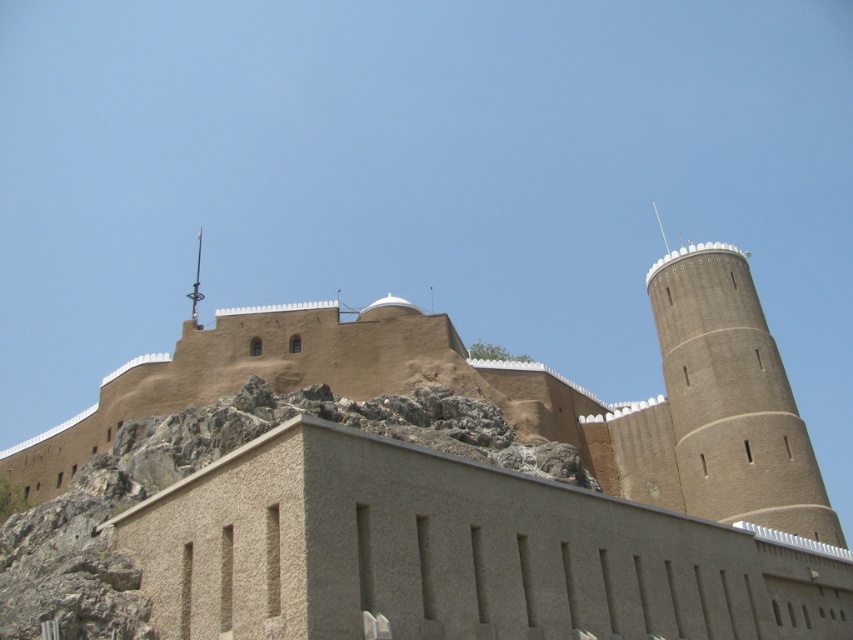
From the picture: Who is higher up, brown textured castle at center or brown textured tower at right?

brown textured tower at right is higher up.

Who is lower down, brown textured castle at center or brown textured tower at right?

Positioned lower is brown textured castle at center.

Image resolution: width=853 pixels, height=640 pixels. In order to click on brown textured castle at center in this screenshot , I will do `click(432, 486)`.

Locate an element on the screen. This screenshot has width=853, height=640. brown textured castle at center is located at coordinates (432, 486).